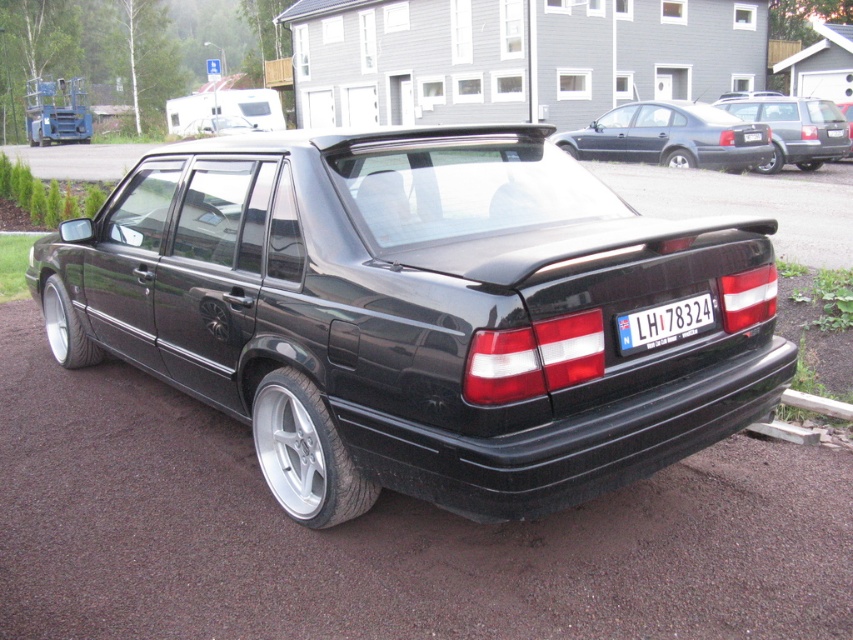
You are a delivery person who needs to place a box on the ground between the matte black car at upper right and the white plastic license plate at center. The box is 1.5 meters long. Can you fit the box horizontally between them without moving either object?

The distance between the matte black car at upper right and the white plastic license plate at center is 3.86 meters. Since the box is only 1.5 meters long, there is enough space to fit it horizontally between them.

You are a delivery person trying to read the license plate of the matte black car at upper right. Can you see the white plastic license plate at center clearly from your current position?

The white plastic license plate at center is behind the matte black car at upper right, so you cannot see it clearly from your current position.

You are standing in front of a black Volvo 850 Turbo sedan parked on a gravel surface. The car has a rear spoiler and silver alloy wheels. There is a point marked at coordinates (750, 202). What object does this point represent?

The point at coordinates (750, 202) represents the black rubber car at center.